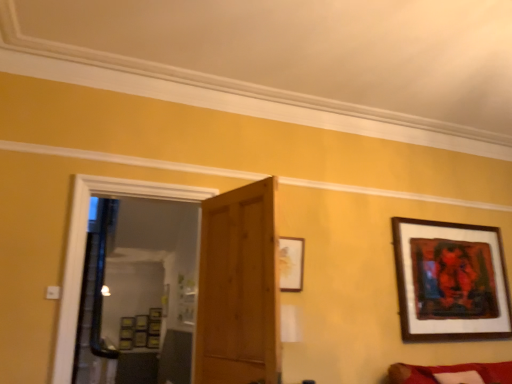
The height and width of the screenshot is (384, 512). What do you see at coordinates (138, 292) in the screenshot? I see `transparent glass door at center` at bounding box center [138, 292].

In order to click on transparent glass door at center in this screenshot , I will do `click(138, 292)`.

Measure the distance between point (436,336) and camera.

Point (436,336) is 3.80 meters away from camera.

Measure the distance between point (144,318) and camera.

The depth of point (144,318) is 6.91 meters.

Locate an element on the screen. wooden door at center is located at coordinates click(x=238, y=289).

The width and height of the screenshot is (512, 384). In order to click on matte gold picture frame at upper center, which is counted as the 1th picture frame, starting from the front in this screenshot , I will do `click(291, 263)`.

In order to face velvet red couch at lower right, should I rotate leftwards or rightwards?

A 26.316 degree turn to the right will do.

Locate an element on the screen. This screenshot has height=384, width=512. wooden picture frame at center, which is counted as the 2th picture frame, starting from the bottom is located at coordinates (155, 313).

Which is behind, transparent glass door at center or wooden picture frame at center, marked as the fourth picture frame in a front-to-back arrangement?

wooden picture frame at center, marked as the fourth picture frame in a front-to-back arrangement, is further away from the camera.

Is transparent glass door at center facing away from wooden picture frame at center, which appears as the third picture frame when viewed from the right?

That's right, transparent glass door at center is facing away from wooden picture frame at center, which appears as the third picture frame when viewed from the right.

Is transparent glass door at center wider than wooden picture frame at center, the third picture frame when ordered from top to bottom?

Yes.

Between transparent glass door at center and wooden picture frame at center, which is counted as the 2th picture frame, starting from the bottom, which one has larger size?

transparent glass door at center is bigger.

From a real-world perspective, is wooden picture frame at center, arranged as the first picture frame when viewed from the back, beneath matte gold picture frame at upper center, which is the third picture frame in left-to-right order?

Yes, from a real-world perspective, wooden picture frame at center, arranged as the first picture frame when viewed from the back, is beneath matte gold picture frame at upper center, which is the third picture frame in left-to-right order.

The width and height of the screenshot is (512, 384). I want to click on picture frame that is the 3rd one when counting forward from the wooden picture frame at center, marked as the second picture frame in a left-to-right arrangement, so click(291, 263).

How far apart are wooden picture frame at center, marked as the second picture frame in a left-to-right arrangement, and matte gold picture frame at upper center, arranged as the 4th picture frame when ordered from the bottom?

wooden picture frame at center, marked as the second picture frame in a left-to-right arrangement, is 14.68 feet away from matte gold picture frame at upper center, arranged as the 4th picture frame when ordered from the bottom.

Is point (161, 317) positioned before point (289, 269)?

No.

From a real-world perspective, is velvet red couch at lower right under wooden door at center?

Correct, in the physical world, velvet red couch at lower right is lower than wooden door at center.

Based on the photo, considering the positions of objects velvet red couch at lower right and wooden door at center in the image provided, who is more to the right, velvet red couch at lower right or wooden door at center?

Positioned to the right is velvet red couch at lower right.

Does point (473, 369) appear closer or farther from the camera than point (216, 306)?

Clearly, point (473, 369) is more distant from the camera than point (216, 306).

Consider the image. Can you tell me how much velvet red couch at lower right and wooden door at center differ in facing direction?

There is a 71.5-degree angle between the facing directions of velvet red couch at lower right and wooden door at center.

Locate an element on the screen. picture frame that is the 2nd one when counting backward from the wooden framed artwork at upper right, marked as the second picture frame in a top-to-bottom arrangement is located at coordinates (155, 313).

From their relative heights in the image, would you say wooden picture frame at center, the third picture frame when ordered from top to bottom, is taller or shorter than wooden framed artwork at upper right, which is the fourth picture frame from left to right?

wooden picture frame at center, the third picture frame when ordered from top to bottom, is shorter than wooden framed artwork at upper right, which is the fourth picture frame from left to right.

Considering the positions of points (391, 375) and (110, 313), is point (391, 375) closer to camera compared to point (110, 313)?

Yes, it is in front of point (110, 313).

In the scene shown: Considering the sizes of objects velvet red couch at lower right and transparent glass door at center in the image provided, who is thinner, velvet red couch at lower right or transparent glass door at center?

transparent glass door at center is thinner.

From a real-world perspective, which object stands above the other?

transparent glass door at center.

From a real-world perspective, which object stands above the other?

In real-world perspective, transparent glass door at center is above.

Which object is positioned more to the right, transparent glass door at center or wooden door at center?

Positioned to the right is wooden door at center.

Looking at this image, which is less distant, (87, 348) or (250, 360)?

Point (87, 348) is farther from the camera than point (250, 360).

Who is more distant, wooden door at center or transparent glass door at center?

transparent glass door at center.

Is wooden door at center next to transparent glass door at center?

They are not placed beside each other.

Is transparent glass door at center located within wooden door at center?

No, wooden door at center does not contain transparent glass door at center.

Find the location of `door in front of the transparent glass door at center`. door in front of the transparent glass door at center is located at coordinates (238, 289).

The image size is (512, 384). Find the location of `glass door that is above the wooden picture frame at center, marked as the second picture frame in a left-to-right arrangement (from a real-world perspective)`. glass door that is above the wooden picture frame at center, marked as the second picture frame in a left-to-right arrangement (from a real-world perspective) is located at coordinates (138, 292).

You are a GUI agent. You are given a task and a screenshot of the screen. Output one action in this format:
    pyautogui.click(x=<x>, y=<y>)
    Task: Click on the picture frame that is the 2nd object directly below the matte gold picture frame at upper center, which is counted as the 2th picture frame, starting from the right (from a real-world perspective)
    
    Given the screenshot: What is the action you would take?
    pyautogui.click(x=155, y=313)

Which object lies further to the anchor point wooden framed artwork at upper right, the 3th picture frame from the back, wooden picture frame at center, which is the 1th picture frame in bottom-to-top order, or wooden picture frame at center, marked as the second picture frame in a left-to-right arrangement?

wooden picture frame at center, which is the 1th picture frame in bottom-to-top order.

Based on their spatial positions, is wooden framed artwork at upper right, marked as the second picture frame in a top-to-bottom arrangement, or matte gold picture frame at upper center, which is counted as the 2th picture frame, starting from the right, further from transparent glass door at center?

The object further to transparent glass door at center is matte gold picture frame at upper center, which is counted as the 2th picture frame, starting from the right.

When comparing their distances from wooden framed artwork at upper right, the 3th picture frame from the back, does wooden picture frame at center, marked as the fourth picture frame in a front-to-back arrangement, or matte gold picture frame at upper center, which is the 1th picture frame from top to bottom, seem closer?

matte gold picture frame at upper center, which is the 1th picture frame from top to bottom, is positioned closer to the anchor wooden framed artwork at upper right, the 3th picture frame from the back.

Estimate the real-world distances between objects in this image. Which object is closer to wooden door at center, matte gold picture frame at upper center, placed as the 4th picture frame when sorted from back to front, or velvet red couch at lower right?

The object closer to wooden door at center is matte gold picture frame at upper center, placed as the 4th picture frame when sorted from back to front.

Considering their positions, is wooden door at center positioned closer to wooden picture frame at center, marked as the second picture frame in a left-to-right arrangement, than wooden framed artwork at upper right, the 3th picture frame from the back?

wooden door at center is positioned closer to the anchor wooden picture frame at center, marked as the second picture frame in a left-to-right arrangement.

Based on their spatial positions, is velvet red couch at lower right or transparent glass door at center further from wooden framed artwork at upper right, marked as the second picture frame in a top-to-bottom arrangement?

Based on the image, transparent glass door at center appears to be further to wooden framed artwork at upper right, marked as the second picture frame in a top-to-bottom arrangement.

Estimate the real-world distances between objects in this image. Which object is closer to transparent glass door at center, matte gold picture frame at upper center, which is the 1th picture frame from top to bottom, or wooden picture frame at center, the 4th picture frame from the top?

wooden picture frame at center, the 4th picture frame from the top.

Based on their spatial positions, is velvet red couch at lower right or wooden door at center closer to wooden framed artwork at upper right, which appears as the 1th picture frame when viewed from the right?

Among the two, velvet red couch at lower right is located nearer to wooden framed artwork at upper right, which appears as the 1th picture frame when viewed from the right.

Locate an element on the screen. couch located between transparent glass door at center and wooden picture frame at center, marked as the second picture frame in a left-to-right arrangement, in the depth direction is located at coordinates (449, 372).

The image size is (512, 384). I want to click on picture frame situated between wooden door at center and velvet red couch at lower right from left to right, so click(x=291, y=263).

Identify the location of couch located between wooden door at center and wooden framed artwork at upper right, the 3th picture frame from the back, in the left-right direction. (449, 372).

Locate an element on the screen. couch between wooden door at center and wooden picture frame at center, the first picture frame when ordered from left to right, from front to back is located at coordinates (449, 372).